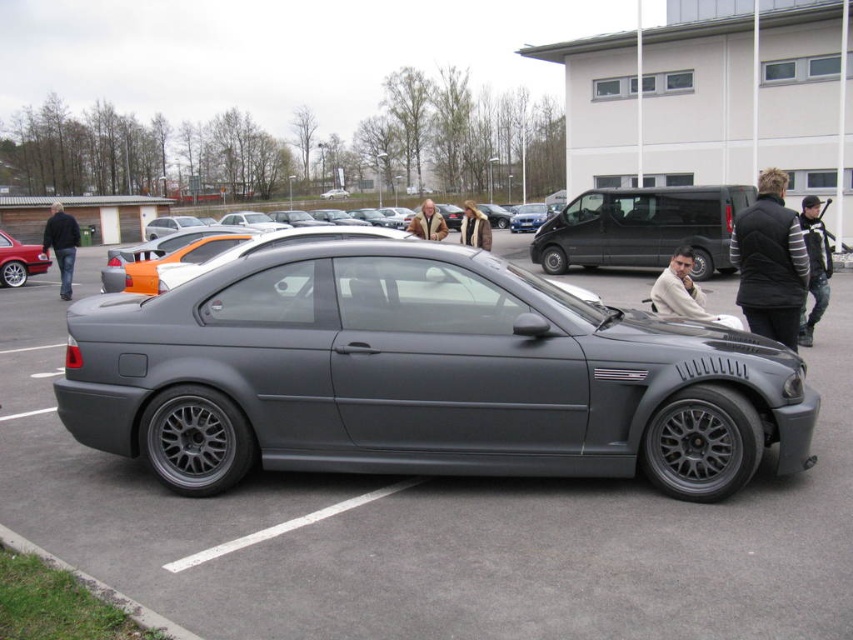
Who is taller, matte gray car at center or brown fur coat at center?

With more height is brown fur coat at center.

Between point (758, 627) and point (479, 246), which one is positioned in front?

Positioned in front is point (758, 627).

At what (x,y) coordinates should I click in order to perform the action: click on matte gray car at center. Please return your answer as a coordinate pair (x, y). This screenshot has width=853, height=640. Looking at the image, I should click on (436, 532).

Does black quilted vest at right have a smaller size compared to black matte license plate at center?

Yes, black quilted vest at right is smaller than black matte license plate at center.

I want to click on black quilted vest at right, so click(x=770, y=260).

Between point (758, 198) and point (527, 224), which one is positioned in front?

Point (758, 198) is in front.

I want to click on black quilted vest at right, so click(770, 260).

In the scene shown: Is black quilted vest at right taller than light brown leather jacket at center?

Incorrect, black quilted vest at right's height is not larger of light brown leather jacket at center's.

Between black quilted vest at right and light brown leather jacket at center, which one is positioned higher?

light brown leather jacket at center is higher up.

Does point (780, 292) lie in front of point (427, 212)?

Yes, point (780, 292) is in front of point (427, 212).

Locate an element on the screen. The height and width of the screenshot is (640, 853). black quilted vest at right is located at coordinates (770, 260).